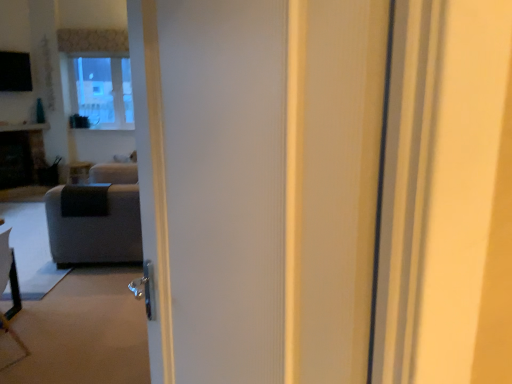
Question: Does point (75, 170) appear closer or farther from the camera than point (29, 127)?

Choices:
 (A) farther
 (B) closer

Answer: (A)

Question: Looking at their shapes, would you say matte black side table at center is wider or thinner than dark gray stone fireplace at left?

Choices:
 (A) wide
 (B) thin

Answer: (B)

Question: Based on their relative distances, which object is farther from the transparent glass window at upper left?

Choices:
 (A) dark gray stone fireplace at left
 (B) gray fabric couch at left
 (C) matte black side table at center

Answer: (B)

Question: Which of these objects is positioned farthest from the gray fabric couch at left?

Choices:
 (A) dark gray stone fireplace at left
 (B) matte black side table at center
 (C) transparent glass window at upper left

Answer: (C)